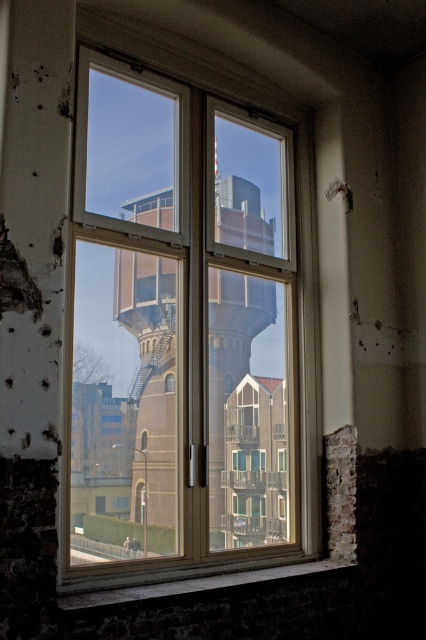
Question: In this image, where is clear glass window at center located relative to brown brick water tower at center?

Choices:
 (A) above
 (B) below

Answer: (A)

Question: Among these points, which one is nearest to the camera?

Choices:
 (A) (255, 468)
 (B) (192, 497)

Answer: (B)

Question: Does clear glass window at center lie in front of brown brick water tower at center?

Choices:
 (A) no
 (B) yes

Answer: (B)

Question: Which point is farther from the camera taking this photo?

Choices:
 (A) (167, 184)
 (B) (247, 186)

Answer: (B)

Question: Where is clear glass window at center located in relation to brown brick water tower at center in the image?

Choices:
 (A) left
 (B) right

Answer: (A)

Question: Which point is farther to the camera?

Choices:
 (A) (77, 442)
 (B) (273, 387)

Answer: (B)